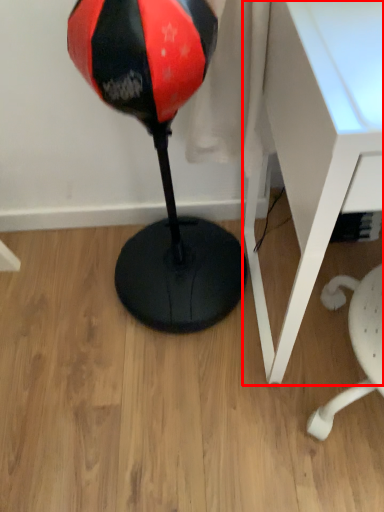
Question: From the image's perspective, what is the correct spatial relationship of table (annotated by the red box) in relation to bean bag chair?

Choices:
 (A) above
 (B) below

Answer: (B)